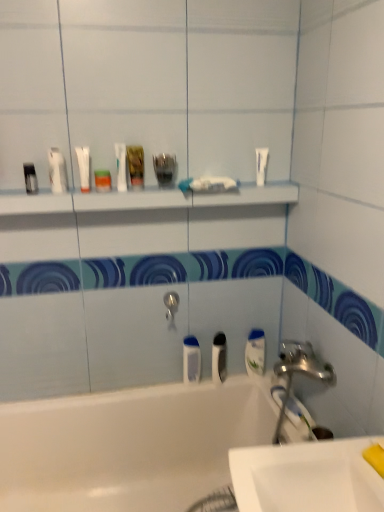
This screenshot has width=384, height=512. I want to click on vacant space to the right of black plastic toothbrush at center, the 4th mouthwash positioned from the top, so click(254, 383).